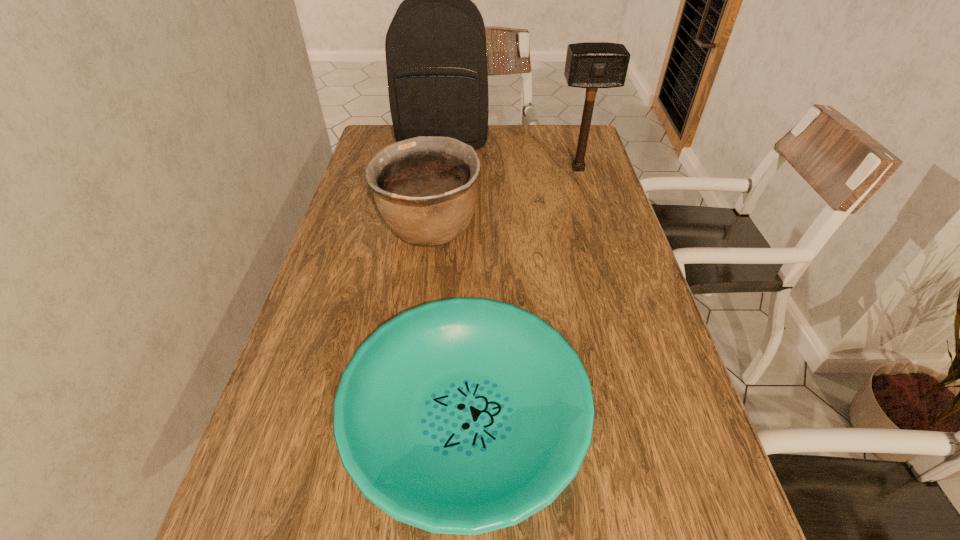
I want to click on backpack at the left edge, so click(x=436, y=58).

Find the location of `pottery present at the left edge`. pottery present at the left edge is located at coordinates (425, 188).

You are a GUI agent. You are given a task and a screenshot of the screen. Output one action in this format:
    pyautogui.click(x=<x>, y=<y>)
    Task: Click on the object that is at the right edge
    The image size is (960, 540).
    Given the screenshot: What is the action you would take?
    pyautogui.click(x=591, y=65)

This screenshot has width=960, height=540. What are the coordinates of `object that is at the far left corner` in the screenshot? It's located at (436, 58).

I want to click on free space at the far edge, so click(x=537, y=153).

You are a GUI agent. You are given a task and a screenshot of the screen. Output one action in this format:
    pyautogui.click(x=<x>, y=<y>)
    Task: Click on the blank space at the left edge of the desktop
    The height and width of the screenshot is (540, 960).
    Given the screenshot: What is the action you would take?
    pyautogui.click(x=321, y=410)

Image resolution: width=960 pixels, height=540 pixels. In the image, there is a desktop. Identify the location of vacant space at the right edge. (612, 286).

Image resolution: width=960 pixels, height=540 pixels. I want to click on vacant region at the far left corner of the desktop, so click(x=392, y=138).

In order to click on vacant point located between the rightmost object and the third farthest object in this screenshot , I will do `click(504, 199)`.

This screenshot has width=960, height=540. I want to click on vacant area between the mallet and the third farthest object, so click(504, 199).